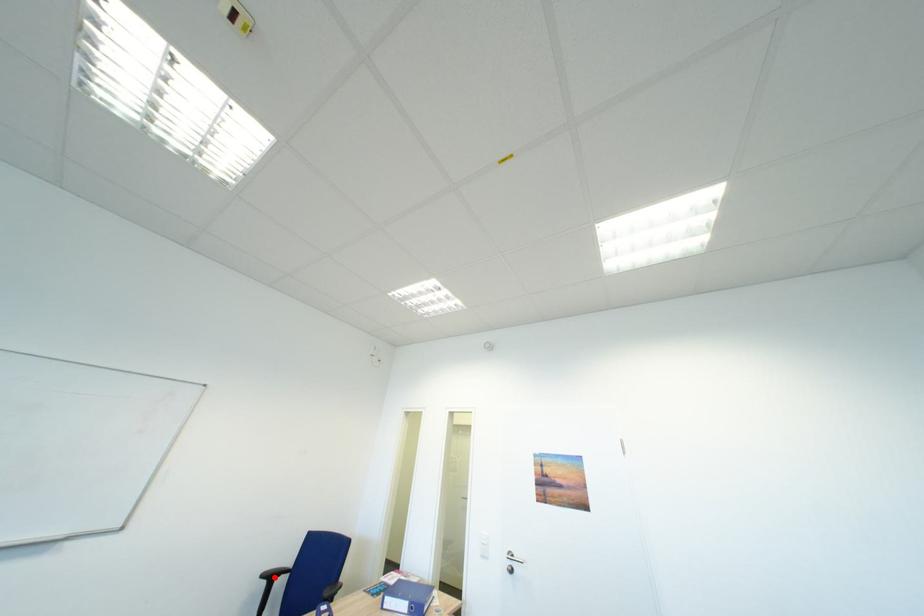
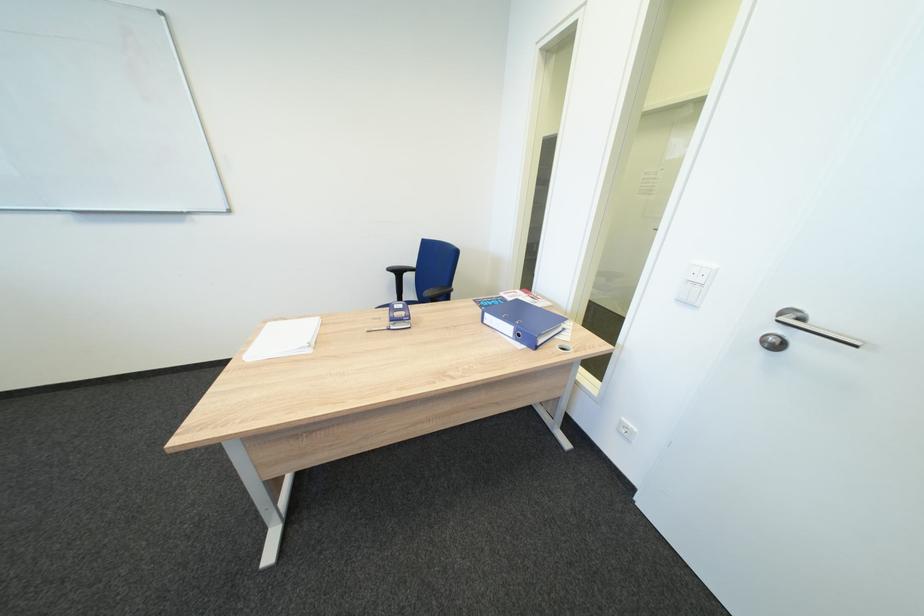
In the second image, find the point that corresponds to the highlighted location in the first image.

(400, 270)